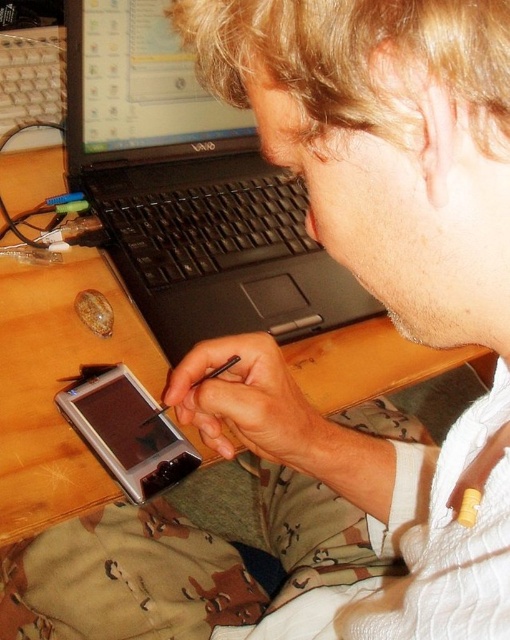
Question: Can you confirm if black plastic laptop at upper center is bigger than wooden table at center?

Choices:
 (A) yes
 (B) no

Answer: (B)

Question: Where is black plastic laptop at upper center located in relation to satin black smartphone at lower center in the image?

Choices:
 (A) left
 (B) right

Answer: (B)

Question: Which object is positioned closest to the black plastic laptop at upper center?

Choices:
 (A) satin black smartphone at lower center
 (B) wooden table at center

Answer: (B)

Question: Which point is farther to the camera?

Choices:
 (A) (335, 352)
 (B) (155, 428)
 (C) (163, 227)

Answer: (C)

Question: Can you confirm if wooden table at center is positioned above satin black smartphone at lower center?

Choices:
 (A) no
 (B) yes

Answer: (B)

Question: Among these objects, which one is nearest to the camera?

Choices:
 (A) wooden table at center
 (B) satin black smartphone at lower center

Answer: (A)